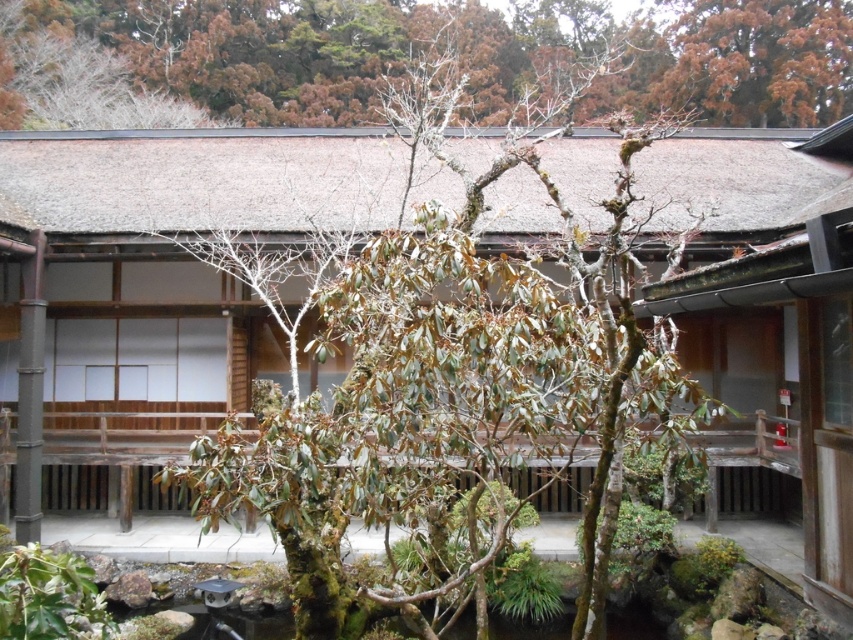
This screenshot has height=640, width=853. What do you see at coordinates (442, 378) in the screenshot? I see `green leafy tree at center` at bounding box center [442, 378].

Identify the location of green leafy tree at center. This screenshot has height=640, width=853. (442, 378).